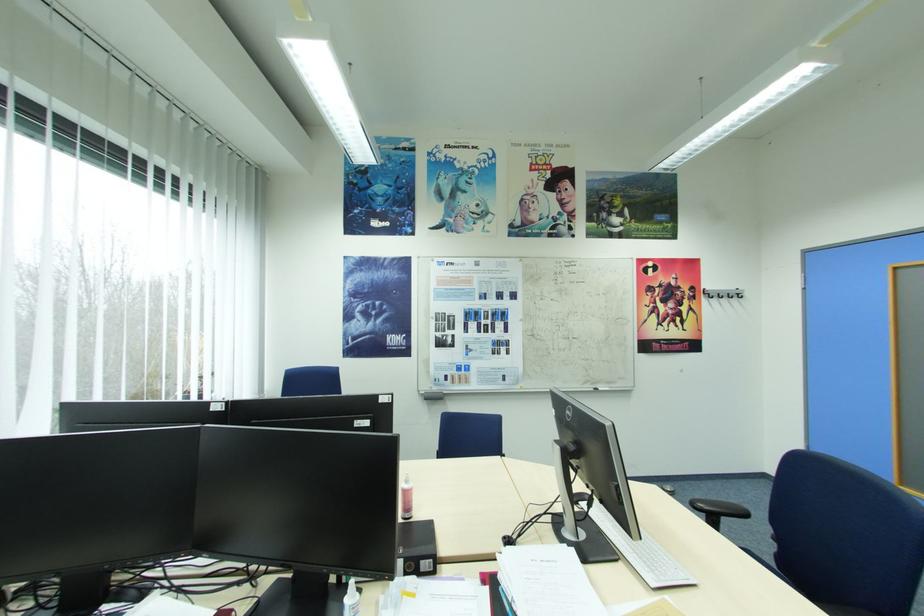
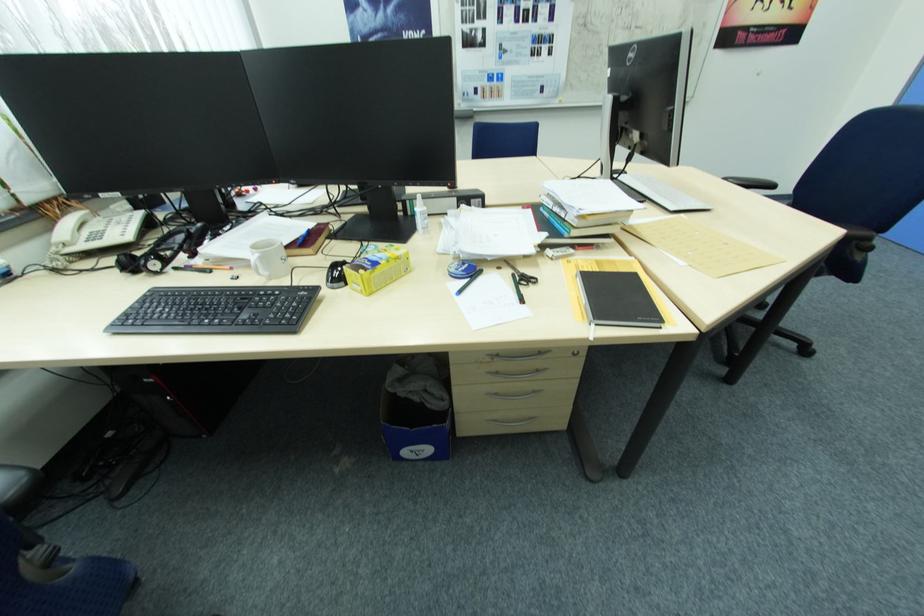
Question: The images are taken continuously from a first-person perspective. In which direction is your viewpoint rotating?

Choices:
 (A) Left
 (B) Right
 (C) Up
 (D) Down

Answer: (D)